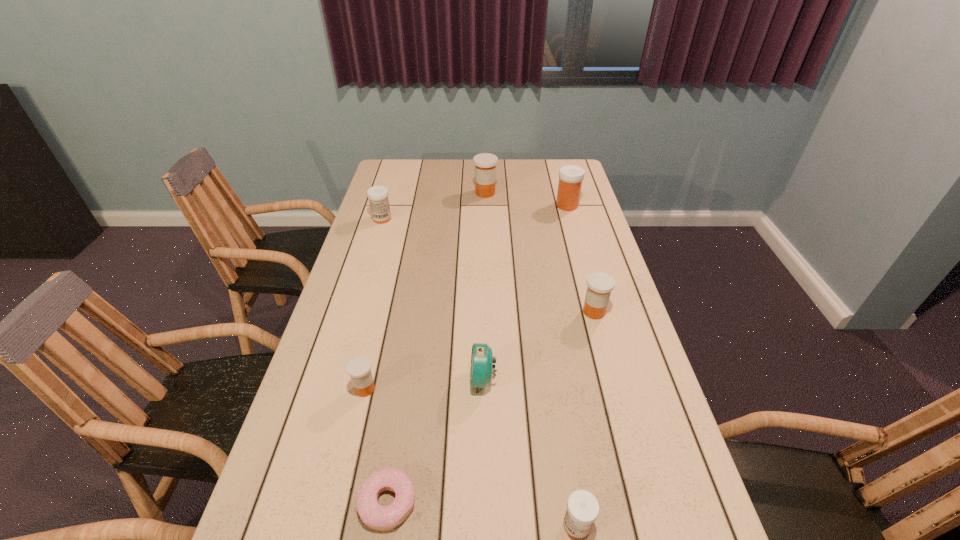
You are a GUI agent. You are given a task and a screenshot of the screen. Output one action in this format:
    pyautogui.click(x=<x>, y=<y>)
    Task: Click on the fourth closest medicine relative to the pink doughnut
    This screenshot has width=960, height=540.
    Given the screenshot: What is the action you would take?
    pyautogui.click(x=378, y=195)

You are a GUI agent. You are given a task and a screenshot of the screen. Output one action in this format:
    pyautogui.click(x=<x>, y=<y>)
    Task: Click on the orange medicine that is the closest to the third nearest medicine
    Image resolution: width=960 pixels, height=540 pixels.
    Given the screenshot: What is the action you would take?
    pyautogui.click(x=359, y=368)

Identify which orange medicine is located as the second nearest to the fourth medicine from right to left. Please provide its 2D coordinates. Your answer should be formatted as a tuple, i.e. [(x, y)], where the tuple contains the x and y coordinates of a point satisfying the conditions above.

[(359, 368)]

Locate an element on the screen. white medicine that can be found as the second closest to the second white medicine from left to right is located at coordinates (378, 195).

Select which white medicine is the closest to the second farthest orange medicine. Please provide its 2D coordinates. Your answer should be formatted as a tuple, i.e. [(x, y)], where the tuple contains the x and y coordinates of a point satisfying the conditions above.

[(570, 176)]

The width and height of the screenshot is (960, 540). I want to click on vacant space that satisfies the following two spatial constraints: 1. on the back side of the leftmost object; 2. on the left side of the biggest white medicine, so click(x=386, y=205).

At what (x,y) coordinates should I click in order to perform the action: click on vacant space that satisfies the following two spatial constraints: 1. on the label of the smallest orange medicine; 2. on the right side of the shortest object. Please return your answer as a coordinate pair (x, y). The image size is (960, 540). Looking at the image, I should click on (339, 502).

I want to click on free point that satisfies the following two spatial constraints: 1. on the front-facing side of the blue alarm clock; 2. on the front side of the shortest object, so click(484, 502).